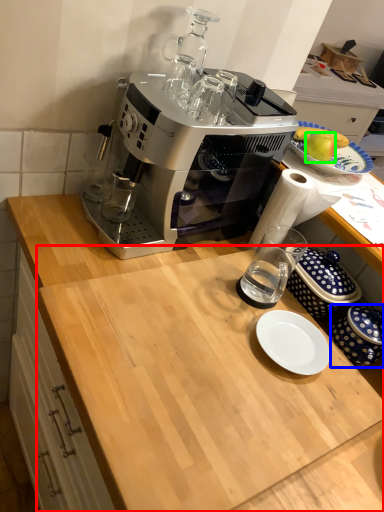
Question: Considering the real-world distances, which object is farthest from counter top (highlighted by a red box)? tableware (highlighted by a blue box) or apple (highlighted by a green box)?

Choices:
 (A) tableware
 (B) apple

Answer: (B)